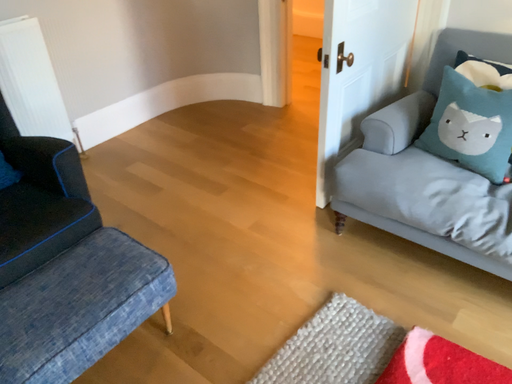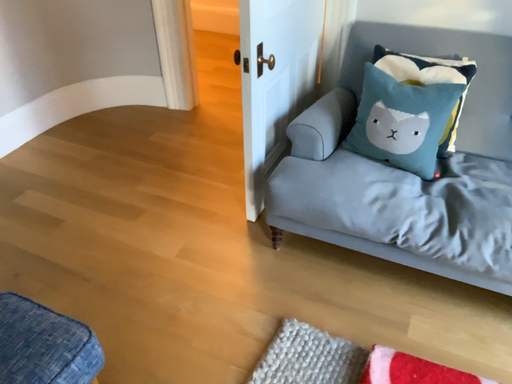
Question: How did the camera likely rotate when shooting the video?

Choices:
 (A) rotated left
 (B) rotated right

Answer: (B)